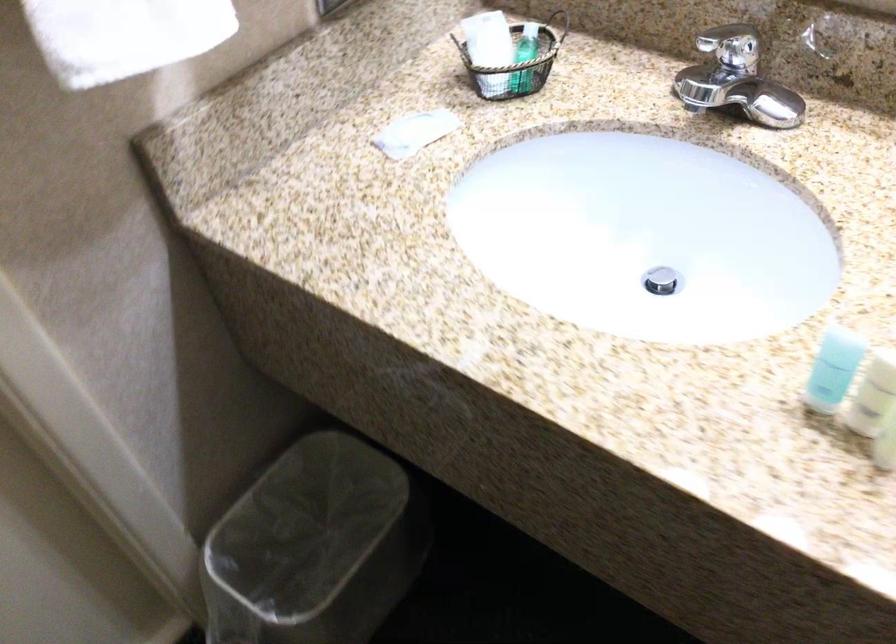
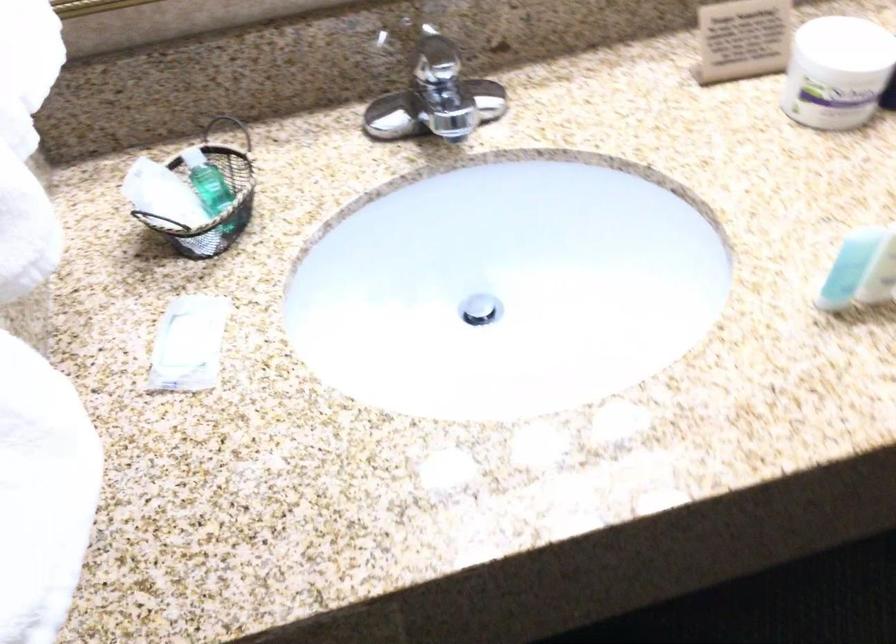
Question: The camera is either moving clockwise (left) or counter-clockwise (right) around the object. The first image is from the beginning of the video and the second image is from the end. Is the camera moving left or right when shooting the video?

Choices:
 (A) Left
 (B) Right

Answer: (A)